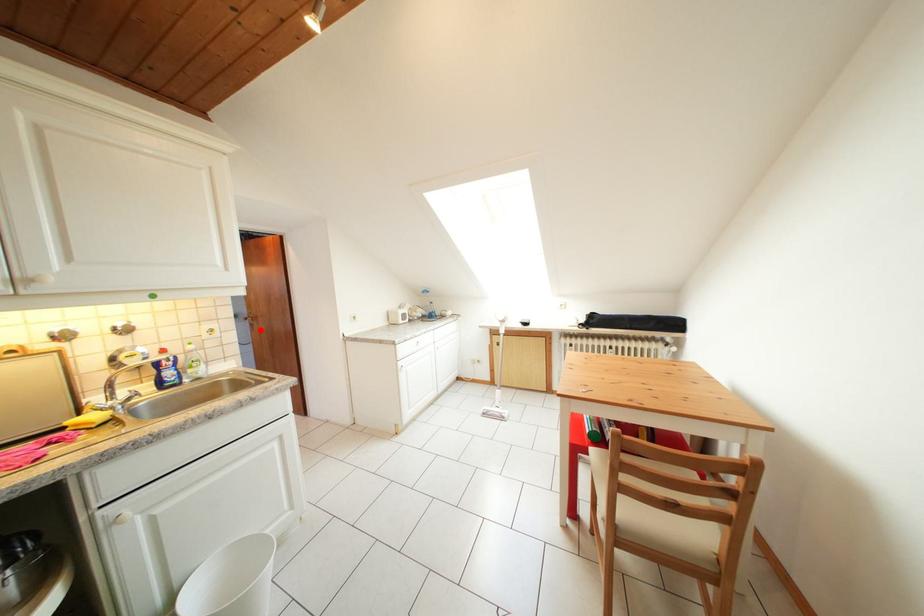
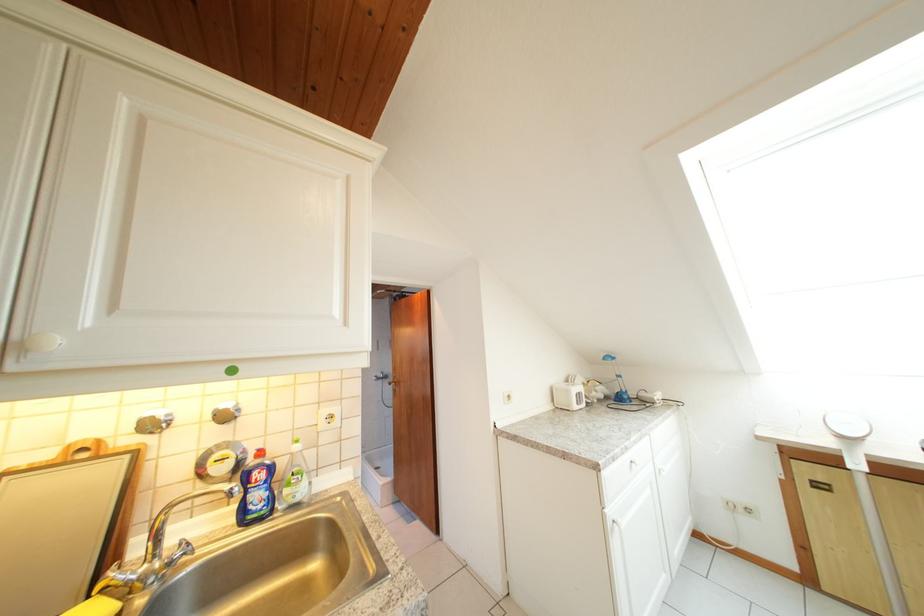
Find the pixel in the second image that matches the highlighted location in the first image.

(403, 395)